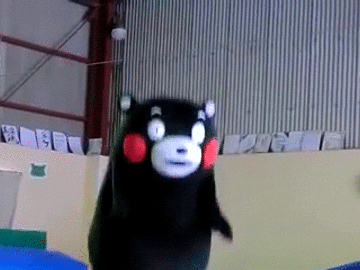
Where is `black teddy bear`? This screenshot has width=360, height=270. black teddy bear is located at coordinates (192, 168).